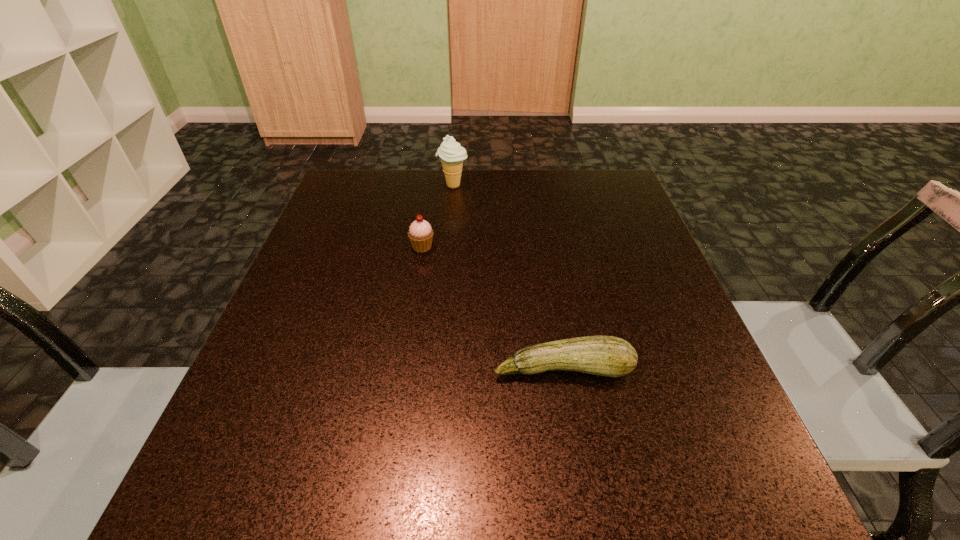
This screenshot has height=540, width=960. Find the location of `icecream`. icecream is located at coordinates (451, 153).

Where is `the farthest object`? the farthest object is located at coordinates (451, 153).

Find the location of `cupcake`. cupcake is located at coordinates (420, 234).

The width and height of the screenshot is (960, 540). Identify the location of the second farthest object. (420, 234).

At what (x,y) coordinates should I click in order to perform the action: click on the nearest object. Please return your answer as a coordinate pair (x, y). Looking at the image, I should click on (610, 356).

You are a GUI agent. You are given a task and a screenshot of the screen. Output one action in this format:
    pyautogui.click(x=<x>, y=<y>)
    Task: Click on the zucchini
    
    Given the screenshot: What is the action you would take?
    pyautogui.click(x=610, y=356)

Image resolution: width=960 pixels, height=540 pixels. Identify the location of blank space located 0.290m on the right of the icecream. (577, 186).

You are a GUI agent. You are given a task and a screenshot of the screen. Output one action in this format:
    pyautogui.click(x=<x>, y=<y>)
    Task: Click on the free region located 0.070m on the back of the second nearest object
    Image resolution: width=960 pixels, height=540 pixels.
    Given the screenshot: What is the action you would take?
    pyautogui.click(x=426, y=221)

Where is `vacant area located 0.090m at the stem end of the zucchini`? Image resolution: width=960 pixels, height=540 pixels. vacant area located 0.090m at the stem end of the zucchini is located at coordinates (575, 438).

Image resolution: width=960 pixels, height=540 pixels. Identify the location of object positioned at the far edge. [451, 153].